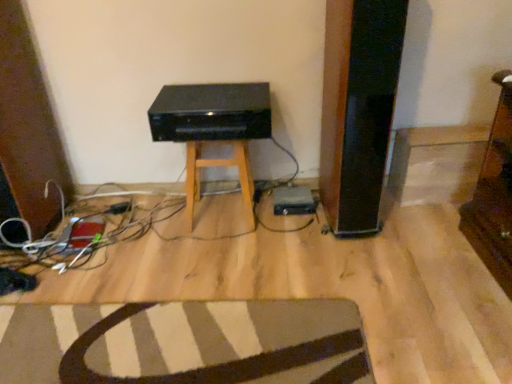
Question: Should I look upward or downward to see black plastic stereo at center?

Choices:
 (A) up
 (B) down

Answer: (A)

Question: Is black matte stool at center positioned with its back to striped fabric rug at lower center?

Choices:
 (A) yes
 (B) no

Answer: (B)

Question: Does black matte stool at center have a lesser height compared to striped fabric rug at lower center?

Choices:
 (A) yes
 (B) no

Answer: (B)

Question: Can you confirm if black matte stool at center is wider than striped fabric rug at lower center?

Choices:
 (A) yes
 (B) no

Answer: (B)

Question: From a real-world perspective, is black matte stool at center on top of striped fabric rug at lower center?

Choices:
 (A) no
 (B) yes

Answer: (B)

Question: Does black matte stool at center have a larger size compared to striped fabric rug at lower center?

Choices:
 (A) yes
 (B) no

Answer: (A)

Question: Is black matte stool at center next to striped fabric rug at lower center?

Choices:
 (A) yes
 (B) no

Answer: (B)

Question: From the image's perspective, is black plastic stereo at center located beneath striped fabric rug at lower center?

Choices:
 (A) no
 (B) yes

Answer: (A)

Question: From a real-world perspective, is black plastic stereo at center below striped fabric rug at lower center?

Choices:
 (A) no
 (B) yes

Answer: (A)

Question: Is the depth of black plastic stereo at center less than that of striped fabric rug at lower center?

Choices:
 (A) yes
 (B) no

Answer: (B)

Question: Can striped fabric rug at lower center be found inside black plastic stereo at center?

Choices:
 (A) yes
 (B) no

Answer: (B)

Question: Is black plastic stereo at center at the left side of striped fabric rug at lower center?

Choices:
 (A) no
 (B) yes

Answer: (A)

Question: Can you confirm if black plastic stereo at center is smaller than striped fabric rug at lower center?

Choices:
 (A) no
 (B) yes

Answer: (A)

Question: Is black matte stool at center at the back of black plastic stereo at center?

Choices:
 (A) yes
 (B) no

Answer: (B)